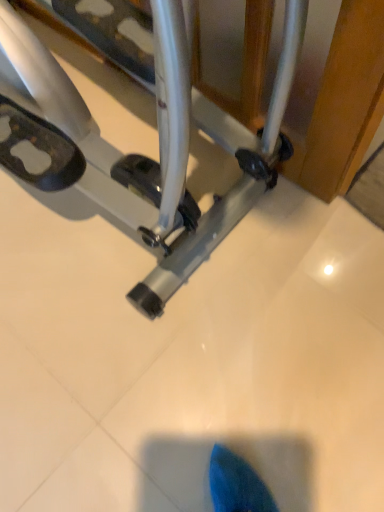
At what (x,y) coordinates should I click in order to perform the action: click on silver metallic stationary bicycle at center. Please return your answer as a coordinate pair (x, y). This screenshot has width=384, height=512. Looking at the image, I should click on (140, 155).

Describe the element at coordinates (140, 155) in the screenshot. I see `silver metallic stationary bicycle at center` at that location.

Where is `silver metallic stationary bicycle at center`? This screenshot has width=384, height=512. silver metallic stationary bicycle at center is located at coordinates (140, 155).